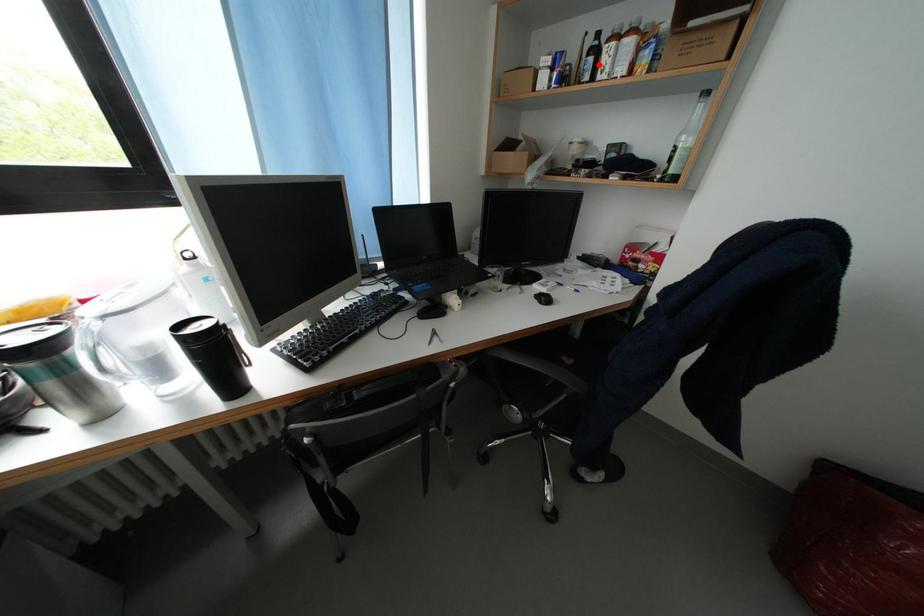
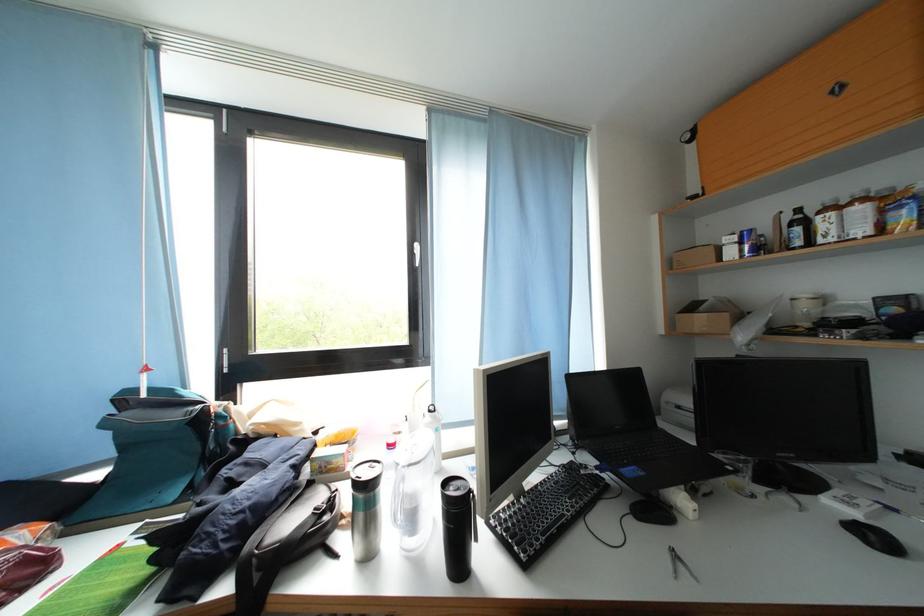
The point at the highlighted location is marked in the first image. Where is the corresponding point in the second image?

(806, 233)